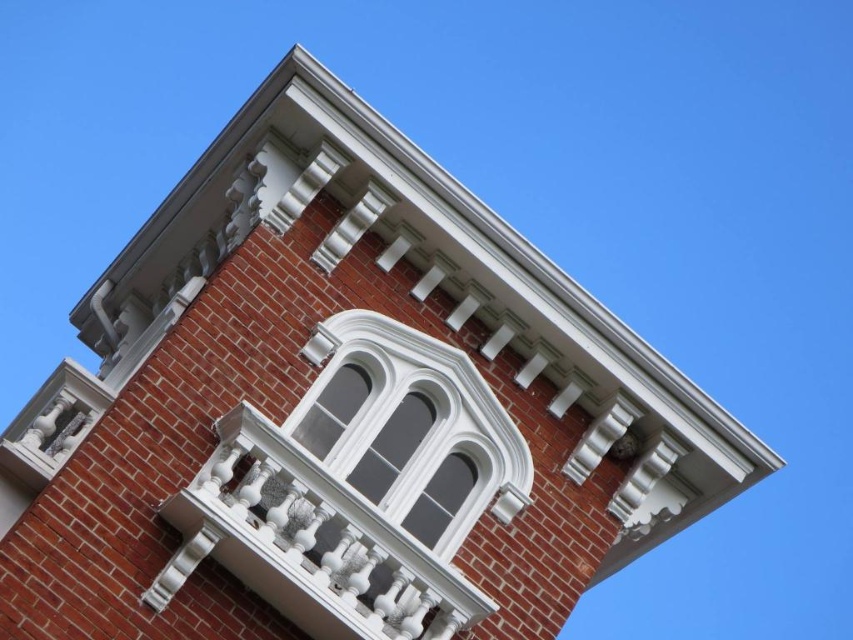
You are standing in front of the brick building and want to locate a specific point marked as point (309, 544). Based on the scene description, where would this point be located?

Point (309, 544) is on the white textured balcony at upper center.

You are standing at the base of the brick building and want to place a 100 feet long banner between the white textured balcony at upper center and another structure. Will the banner be long enough?

The distance between the white textured balcony at upper center and the other structure is 127.91 feet. Since the banner is only 100 feet long, it will not be long enough to span the gap.